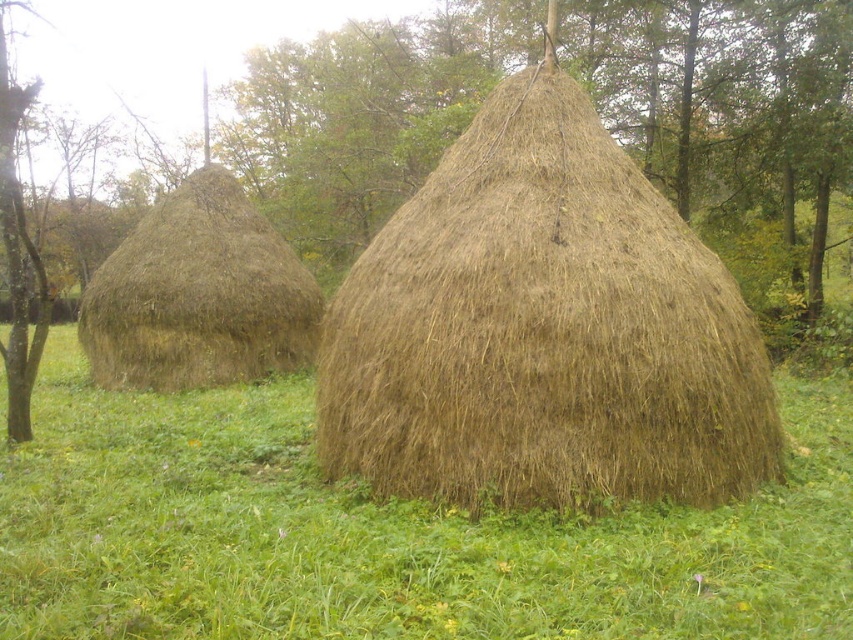
Question: Does brown straw bale at center appear over brown straw hut at left?

Choices:
 (A) no
 (B) yes

Answer: (A)

Question: Is brown straw bale at center above brown straw stack at center?

Choices:
 (A) no
 (B) yes

Answer: (A)

Question: From the image, what is the correct spatial relationship of brown straw bale at center in relation to brown straw hut at left?

Choices:
 (A) left
 (B) right

Answer: (B)

Question: Which is nearer to the brown straw stack at center?

Choices:
 (A) brown straw bale at center
 (B) brown straw hut at left

Answer: (A)

Question: Among these objects, which one is nearest to the camera?

Choices:
 (A) brown straw stack at center
 (B) brown straw hut at left

Answer: (A)

Question: Among these points, which one is farthest from the camera?

Choices:
 (A) (122, 376)
 (B) (440, 410)

Answer: (A)